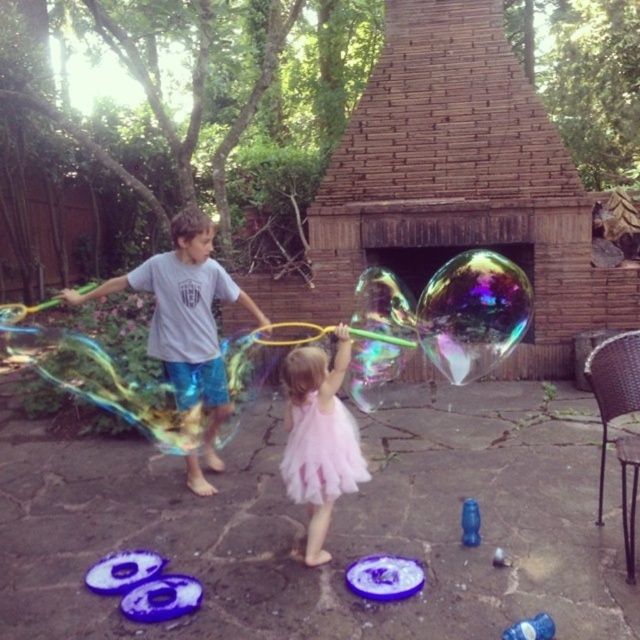
Question: From the image, what is the correct spatial relationship of pink tulle dress at center in relation to blue plastic toy at lower center?

Choices:
 (A) below
 (B) above

Answer: (B)

Question: Which object is farther from the camera taking this photo?

Choices:
 (A) pink tulle ballet skirt at center
 (B) pink tulle dress at center
 (C) blue plastic toy at lower center

Answer: (C)

Question: Where is matte gray t-shirt at center located in relation to pink tulle dress at center in the image?

Choices:
 (A) right
 (B) left

Answer: (B)

Question: Where is matte gray t-shirt at center located in relation to blue plastic toy at lower center in the image?

Choices:
 (A) right
 (B) left

Answer: (B)

Question: Which object appears closest to the camera in this image?

Choices:
 (A) matte gray t-shirt at center
 (B) blue plastic toy at lower center
 (C) pink tulle ballet skirt at center

Answer: (C)

Question: Which point is farther from the camera taking this photo?

Choices:
 (A) [468, 497]
 (B) [332, 442]
 (C) [349, 454]
 (D) [188, 298]

Answer: (D)